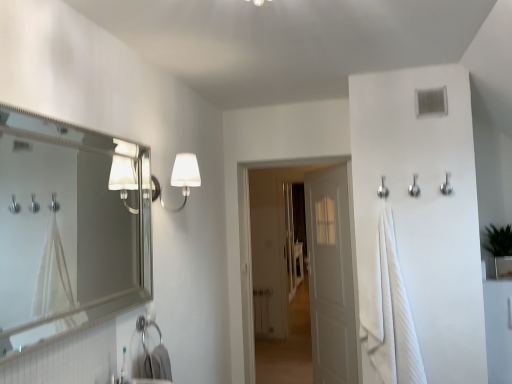
Question: Does white fabric lampshade at upper center lie behind white plastic vent at upper right?

Choices:
 (A) no
 (B) yes

Answer: (A)

Question: Is white fabric lampshade at upper center completely or partially outside of white plastic vent at upper right?

Choices:
 (A) yes
 (B) no

Answer: (A)

Question: Considering the relative sizes of white fabric lampshade at upper center and white plastic vent at upper right in the image provided, is white fabric lampshade at upper center thinner than white plastic vent at upper right?

Choices:
 (A) no
 (B) yes

Answer: (A)

Question: Is white fabric lampshade at upper center far from white plastic vent at upper right?

Choices:
 (A) no
 (B) yes

Answer: (B)

Question: Considering the relative positions of white fabric lampshade at upper center and white plastic vent at upper right in the image provided, is white fabric lampshade at upper center to the right of white plastic vent at upper right from the viewer's perspective?

Choices:
 (A) yes
 (B) no

Answer: (B)

Question: Would you say white plastic vent at upper right is inside or outside white plastic toothbrush at lower left?

Choices:
 (A) outside
 (B) inside

Answer: (A)

Question: Looking at their shapes, would you say white plastic vent at upper right is wider or thinner than white plastic toothbrush at lower left?

Choices:
 (A) thin
 (B) wide

Answer: (A)

Question: From the image's perspective, relative to white plastic toothbrush at lower left, is white plastic vent at upper right above or below?

Choices:
 (A) below
 (B) above

Answer: (B)

Question: From a real-world perspective, is white plastic vent at upper right above or below white plastic toothbrush at lower left?

Choices:
 (A) above
 (B) below

Answer: (A)

Question: Would you say white plastic vent at upper right is inside or outside white matte door at center, which is the second door from front to back?

Choices:
 (A) outside
 (B) inside

Answer: (A)

Question: From the image's perspective, is white plastic vent at upper right positioned above or below white matte door at center, positioned as the first door in back-to-front order?

Choices:
 (A) above
 (B) below

Answer: (A)

Question: Visually, is white plastic vent at upper right positioned to the left or to the right of white matte door at center, positioned as the first door in back-to-front order?

Choices:
 (A) right
 (B) left

Answer: (A)

Question: Is point (424, 112) positioned closer to the camera than point (339, 344)?

Choices:
 (A) closer
 (B) farther

Answer: (A)

Question: Is silver metallic hook at upper right, acting as the 3th shower starting from the left, inside the boundaries of white fabric lampshade at upper center, or outside?

Choices:
 (A) outside
 (B) inside

Answer: (A)

Question: Is silver metallic hook at upper right, the first shower viewed from the right, in front of or behind white fabric lampshade at upper center in the image?

Choices:
 (A) front
 (B) behind

Answer: (B)